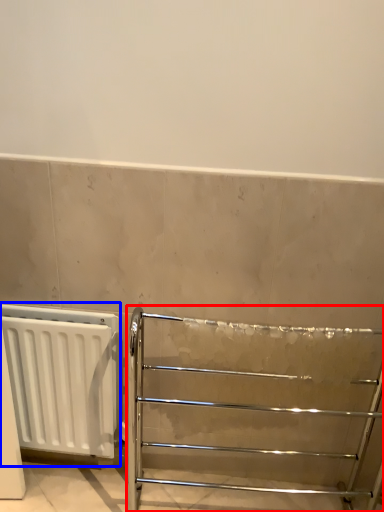
Question: Which object is further to the camera taking this photo, furniture (highlighted by a red box) or radiator (highlighted by a blue box)?

Choices:
 (A) furniture
 (B) radiator

Answer: (B)